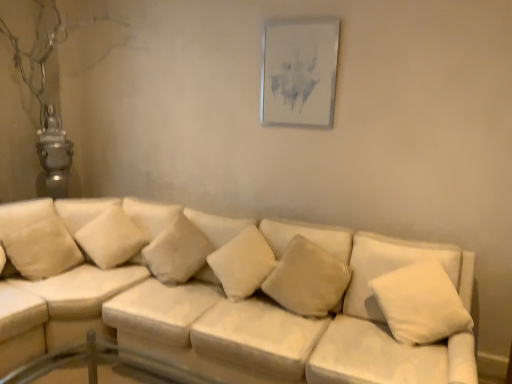
Question: Is soft beige pillow at center, the 5th pillow from the left, oriented towards white fabric couch at center?

Choices:
 (A) no
 (B) yes

Answer: (B)

Question: Is soft beige pillow at center, the second pillow viewed from the right, placed right next to white fabric couch at center?

Choices:
 (A) no
 (B) yes

Answer: (A)

Question: From the image's perspective, would you say soft beige pillow at center, the 5th pillow from the left, is shown under white fabric couch at center?

Choices:
 (A) no
 (B) yes

Answer: (A)

Question: Can white fabric couch at center be found inside soft beige pillow at center, the second pillow viewed from the right?

Choices:
 (A) yes
 (B) no

Answer: (B)

Question: Is soft beige pillow at center, the 5th pillow from the left, in front of white fabric couch at center?

Choices:
 (A) yes
 (B) no

Answer: (B)

Question: Looking at their shapes, would you say white soft cushion at left, positioned as the first pillow in left-to-right order, is wider or thinner than white soft pillow at center, the third pillow from the left?

Choices:
 (A) wide
 (B) thin

Answer: (B)

Question: Considering the positions of point (42, 215) and point (185, 279), is point (42, 215) closer or farther from the camera than point (185, 279)?

Choices:
 (A) closer
 (B) farther

Answer: (B)

Question: From their relative heights in the image, would you say white soft cushion at left, positioned as the first pillow in left-to-right order, is taller or shorter than white soft pillow at center, the third pillow from the left?

Choices:
 (A) tall
 (B) short

Answer: (A)

Question: Is white soft cushion at left, positioned as the first pillow in left-to-right order, in front of or behind white soft pillow at center, the fourth pillow in the right-to-left sequence, in the image?

Choices:
 (A) behind
 (B) front

Answer: (A)

Question: From the image's perspective, is white soft cushion at left, positioned as the first pillow in left-to-right order, positioned above or below white soft pillow at upper left, the 5th pillow positioned from the right?

Choices:
 (A) below
 (B) above

Answer: (A)

Question: Considering the positions of white soft cushion at left, positioned as the first pillow in left-to-right order, and white soft pillow at upper left, positioned as the 2th pillow in left-to-right order, in the image, is white soft cushion at left, positioned as the first pillow in left-to-right order, wider or thinner than white soft pillow at upper left, positioned as the 2th pillow in left-to-right order,?

Choices:
 (A) thin
 (B) wide

Answer: (A)

Question: In terms of height, does white soft cushion at left, which is the sixth pillow in right-to-left order, look taller or shorter compared to white soft pillow at upper left, positioned as the 2th pillow in left-to-right order?

Choices:
 (A) tall
 (B) short

Answer: (A)

Question: In terms of size, does white soft cushion at left, positioned as the first pillow in left-to-right order, appear bigger or smaller than white soft pillow at upper left, positioned as the 2th pillow in left-to-right order?

Choices:
 (A) big
 (B) small

Answer: (B)

Question: Is white soft pillow at center, the fourth pillow in the right-to-left sequence, wider or thinner than metallic silver picture frame at upper center?

Choices:
 (A) thin
 (B) wide

Answer: (B)

Question: Is white soft pillow at center, the fourth pillow in the right-to-left sequence, bigger or smaller than metallic silver picture frame at upper center?

Choices:
 (A) small
 (B) big

Answer: (B)